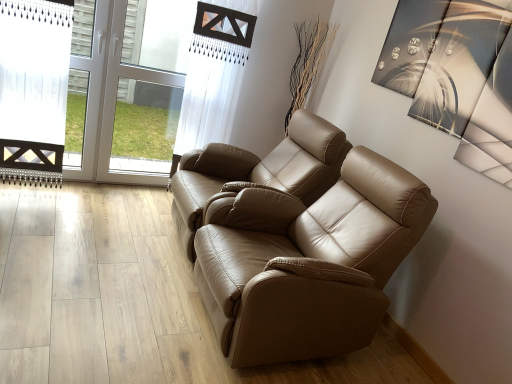
The image size is (512, 384). Describe the element at coordinates (259, 171) in the screenshot. I see `tan leather sofa at center, the first chair when ordered from back to front` at that location.

In order to face tan leather sofa at center, the first chair when ordered from back to front, should I rotate leftwards or rightwards?

Rotate left and turn 0.466 degrees.

Measure the distance between point (199, 239) and camera.

Point (199, 239) is 2.13 meters from camera.

Locate an element on the screen. The height and width of the screenshot is (384, 512). transparent glass door at upper left is located at coordinates (109, 97).

At what (x,y) coordinates should I click in order to perform the action: click on tan leather sofa at center, the first chair when ordered from back to front. Please return your answer as a coordinate pair (x, y). This screenshot has width=512, height=384. Looking at the image, I should click on (259, 171).

Can you confirm if tan leather sofa at center, which is the 1th chair from front to back, is wider than transparent glass door at upper left?

→ Yes.

From the image's perspective, is tan leather sofa at center, which is the 1th chair from front to back, located beneath transparent glass door at upper left?

Yes, from the image's perspective, tan leather sofa at center, which is the 1th chair from front to back, is beneath transparent glass door at upper left.

Consider the image. Which object is closer to the camera taking this photo, tan leather sofa at center, which is the second chair in back-to-front order, or transparent glass door at upper left?

tan leather sofa at center, which is the second chair in back-to-front order, is more forward.

Considering the relative sizes of tan leather sofa at center, which is the 1th chair from front to back, and transparent glass door at upper left in the image provided, is tan leather sofa at center, which is the 1th chair from front to back, taller than transparent glass door at upper left?

No.

Does transparent glass door at upper left come in front of tan leather sofa at center, which is the second chair in back-to-front order?

No, transparent glass door at upper left is further to the viewer.

How distant is transparent glass door at upper left from tan leather sofa at center, which is the 1th chair from front to back?

transparent glass door at upper left is 5.90 feet from tan leather sofa at center, which is the 1th chair from front to back.

Find the location of a particular element. This screenshot has width=512, height=384. glass door that appears above the tan leather sofa at center, which is the second chair in back-to-front order (from a real-world perspective) is located at coordinates (109, 97).

Is transparent glass door at upper left smaller than tan leather sofa at center, which is the 1th chair from front to back?

Correct, transparent glass door at upper left occupies less space than tan leather sofa at center, which is the 1th chair from front to back.

Which of these two, tan leather sofa at center, arranged as the second chair when viewed from the front, or transparent glass door at upper left, is wider?

tan leather sofa at center, arranged as the second chair when viewed from the front.

Which of these two, tan leather sofa at center, the first chair when ordered from back to front, or transparent glass door at upper left, is smaller?

With smaller size is transparent glass door at upper left.

Who is more distant, tan leather sofa at center, arranged as the second chair when viewed from the front, or transparent glass door at upper left?

transparent glass door at upper left.

From a real-world perspective, is tan leather sofa at center, which is the second chair in back-to-front order, physically below tan leather sofa at center, arranged as the second chair when viewed from the front?

Yes, from a real-world perspective, tan leather sofa at center, which is the second chair in back-to-front order, is below tan leather sofa at center, arranged as the second chair when viewed from the front.

Considering the sizes of objects tan leather sofa at center, which is the 1th chair from front to back, and tan leather sofa at center, arranged as the second chair when viewed from the front, in the image provided, who is wider, tan leather sofa at center, which is the 1th chair from front to back, or tan leather sofa at center, arranged as the second chair when viewed from the front,?

Wider between the two is tan leather sofa at center, which is the 1th chair from front to back.

Based on the photo, which object is positioned more to the left, tan leather sofa at center, the first chair when ordered from back to front, or tan leather sofa at center, which is the second chair in back-to-front order?

tan leather sofa at center, the first chair when ordered from back to front, is more to the left.

From a real-world perspective, does tan leather sofa at center, the first chair when ordered from back to front, stand above tan leather sofa at center, which is the second chair in back-to-front order?

Yes, from a real-world perspective, tan leather sofa at center, the first chair when ordered from back to front, is above tan leather sofa at center, which is the second chair in back-to-front order.

From the image's perspective, which object appears higher, tan leather sofa at center, the first chair when ordered from back to front, or tan leather sofa at center, which is the 1th chair from front to back?

tan leather sofa at center, the first chair when ordered from back to front, is shown above in the image.

How far apart are tan leather sofa at center, the first chair when ordered from back to front, and tan leather sofa at center, which is the second chair in back-to-front order?

tan leather sofa at center, the first chair when ordered from back to front, and tan leather sofa at center, which is the second chair in back-to-front order, are 45.33 centimeters apart from each other.

Which object is further away from the camera, transparent glass door at upper left or tan leather sofa at center, arranged as the second chair when viewed from the front?

transparent glass door at upper left is behind.

From the image's perspective, is transparent glass door at upper left below tan leather sofa at center, arranged as the second chair when viewed from the front?

No.

Is transparent glass door at upper left beside tan leather sofa at center, arranged as the second chair when viewed from the front?

No, transparent glass door at upper left is not with tan leather sofa at center, arranged as the second chair when viewed from the front.

Based on their sizes in the image, would you say transparent glass door at upper left is bigger or smaller than tan leather sofa at center, arranged as the second chair when viewed from the front?

Considering their sizes, transparent glass door at upper left takes up less space than tan leather sofa at center, arranged as the second chair when viewed from the front.

Where is `chair that is the 2nd one when counting forward from the transparent glass door at upper left`? The height and width of the screenshot is (384, 512). chair that is the 2nd one when counting forward from the transparent glass door at upper left is located at coordinates (310, 263).

Starting from the transparent glass door at upper left, which chair is the 2nd one to the right? Please provide its 2D coordinates.

[(310, 263)]

From the image, which object appears to be farther from tan leather sofa at center, which is the second chair in back-to-front order, tan leather sofa at center, arranged as the second chair when viewed from the front, or transparent glass door at upper left?

transparent glass door at upper left is further to tan leather sofa at center, which is the second chair in back-to-front order.

Considering their positions, is transparent glass door at upper left positioned closer to tan leather sofa at center, arranged as the second chair when viewed from the front, than tan leather sofa at center, which is the 1th chair from front to back?

tan leather sofa at center, which is the 1th chair from front to back, is closer to tan leather sofa at center, arranged as the second chair when viewed from the front.

From the image, which object appears to be farther from tan leather sofa at center, which is the 1th chair from front to back, transparent glass door at upper left or tan leather sofa at center, the first chair when ordered from back to front?

transparent glass door at upper left is positioned further to the anchor tan leather sofa at center, which is the 1th chair from front to back.

Estimate the real-world distances between objects in this image. Which object is further from transparent glass door at upper left, tan leather sofa at center, which is the 1th chair from front to back, or tan leather sofa at center, arranged as the second chair when viewed from the front?

tan leather sofa at center, which is the 1th chair from front to back, is further to transparent glass door at upper left.

From the image, which object appears to be nearer to transparent glass door at upper left, tan leather sofa at center, arranged as the second chair when viewed from the front, or tan leather sofa at center, which is the 1th chair from front to back?

Based on the image, tan leather sofa at center, arranged as the second chair when viewed from the front, appears to be nearer to transparent glass door at upper left.

Based on the photo, based on their spatial positions, is tan leather sofa at center, which is the 1th chair from front to back, or transparent glass door at upper left closer to tan leather sofa at center, arranged as the second chair when viewed from the front?

tan leather sofa at center, which is the 1th chair from front to back, is positioned closer to the anchor tan leather sofa at center, arranged as the second chair when viewed from the front.

Where is `chair positioned between tan leather sofa at center, which is the 1th chair from front to back, and transparent glass door at upper left from near to far`? The height and width of the screenshot is (384, 512). chair positioned between tan leather sofa at center, which is the 1th chair from front to back, and transparent glass door at upper left from near to far is located at coordinates (259, 171).